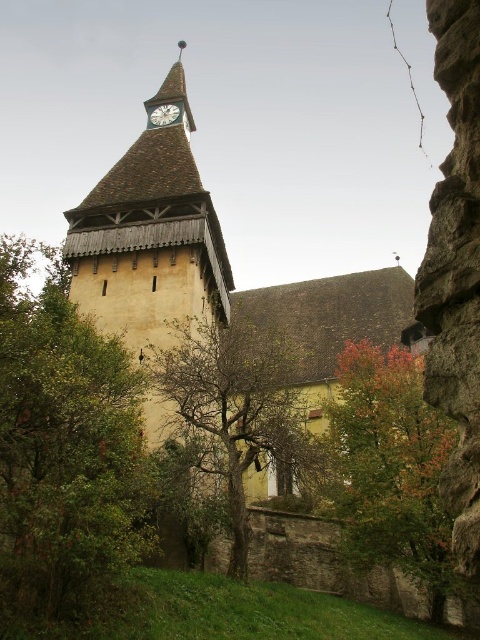
Question: Which point is closer to the camera?

Choices:
 (A) (94, 337)
 (B) (313, 326)
 (C) (302, 461)
 (D) (165, 124)

Answer: (A)

Question: Is green leafy tree at right closer to camera compared to white wooden clock at upper center?

Choices:
 (A) yes
 (B) no

Answer: (A)

Question: Which is nearer to the green leafy tree at left?

Choices:
 (A) green leafy tree at right
 (B) green leafy tree at center
 (C) white wooden clock at upper center
 (D) yellow wooden clock tower at center

Answer: (B)

Question: Does green leafy tree at right have a lesser width compared to green leafy tree at center?

Choices:
 (A) yes
 (B) no

Answer: (A)

Question: Which point is farther to the camera?

Choices:
 (A) (214, 342)
 (B) (3, 529)

Answer: (A)

Question: Can you confirm if yellow wooden clock tower at center is positioned above green leafy tree at right?

Choices:
 (A) yes
 (B) no

Answer: (A)